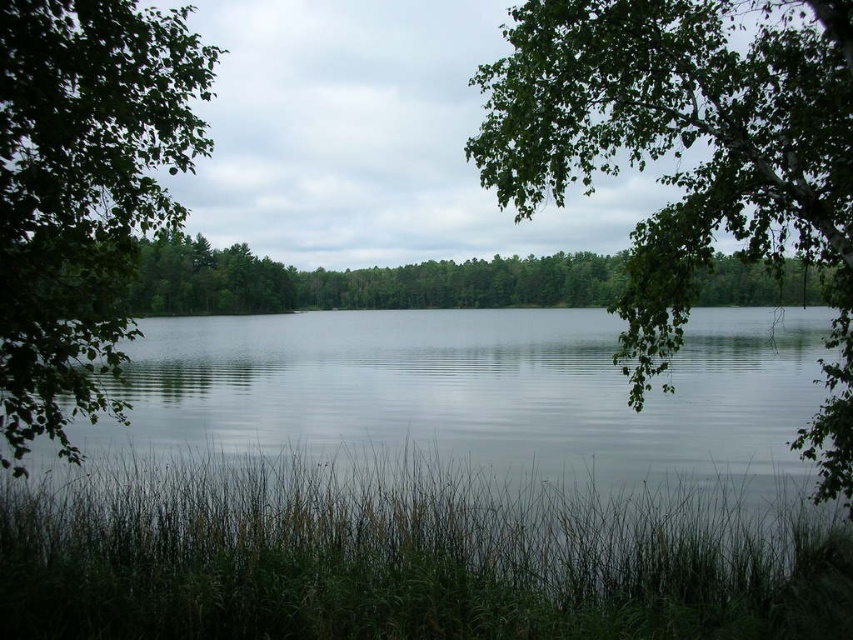
You are standing at the edge of the lake and notice two green leafy trees in the scene. Which tree, the green leafy tree at upper right or the green leafy tree at left, is closer to you?

The green leafy tree at upper right is closer to you because the green leafy tree at left is behind it.